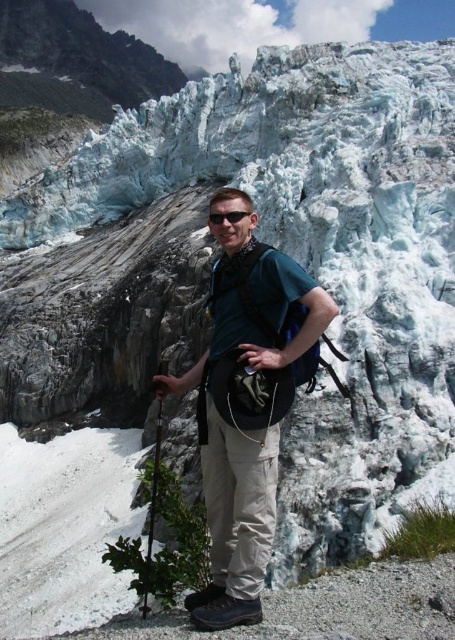
Between green fabric backpack at center and sunglasses at center, which one is positioned higher?

sunglasses at center

Between green fabric backpack at center and sunglasses at center, which one is positioned lower?

Positioned lower is green fabric backpack at center.

The height and width of the screenshot is (640, 455). Identify the location of green fabric backpack at center. (247, 403).

Locate an element on the screen. The width and height of the screenshot is (455, 640). green fabric backpack at center is located at coordinates (247, 403).